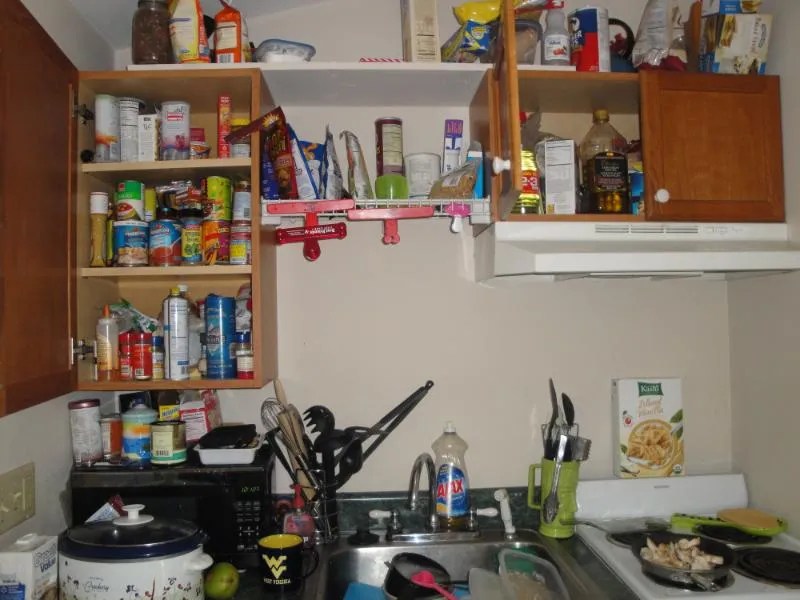
Identify the location of basin. (454, 555).